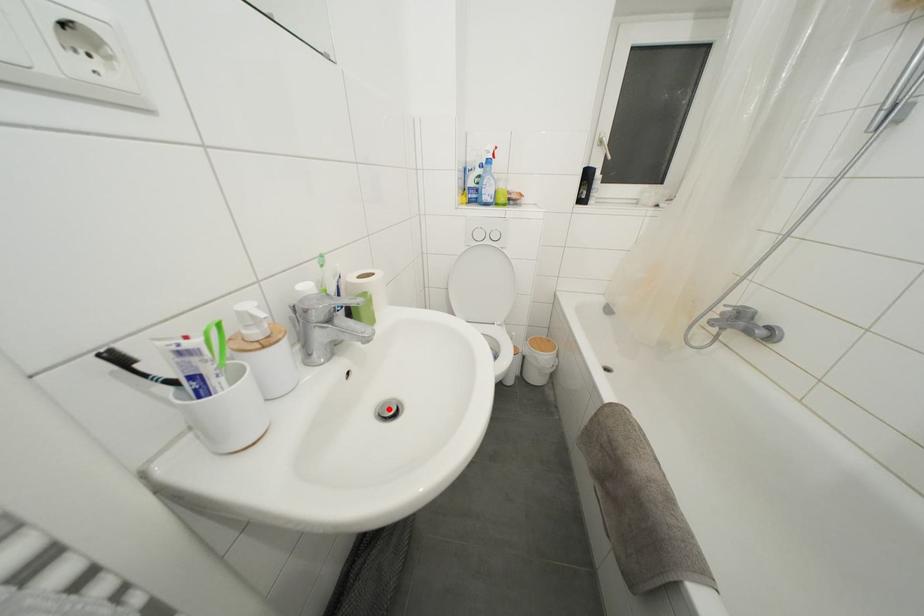
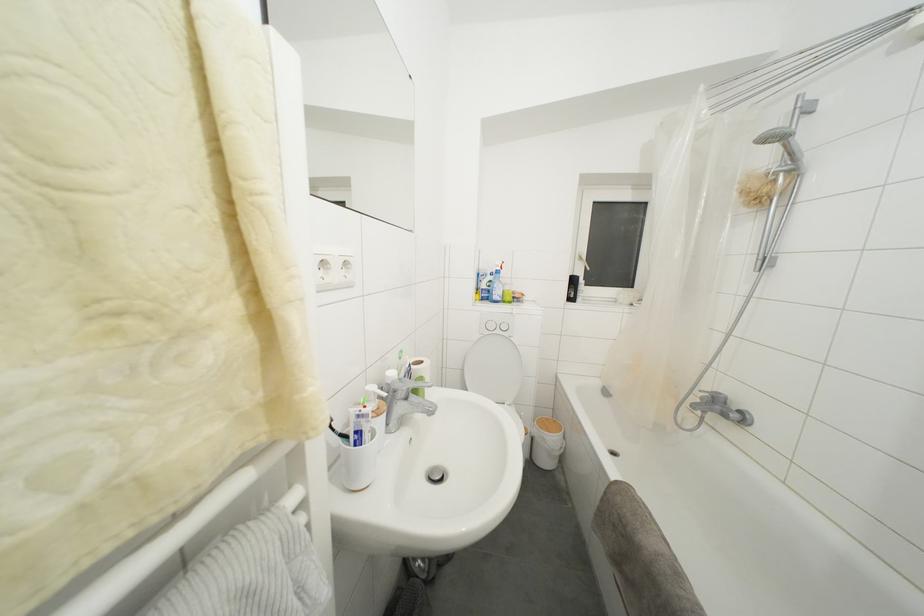
In the second image, find the point that corresponds to the highlighted location in the first image.

(436, 475)